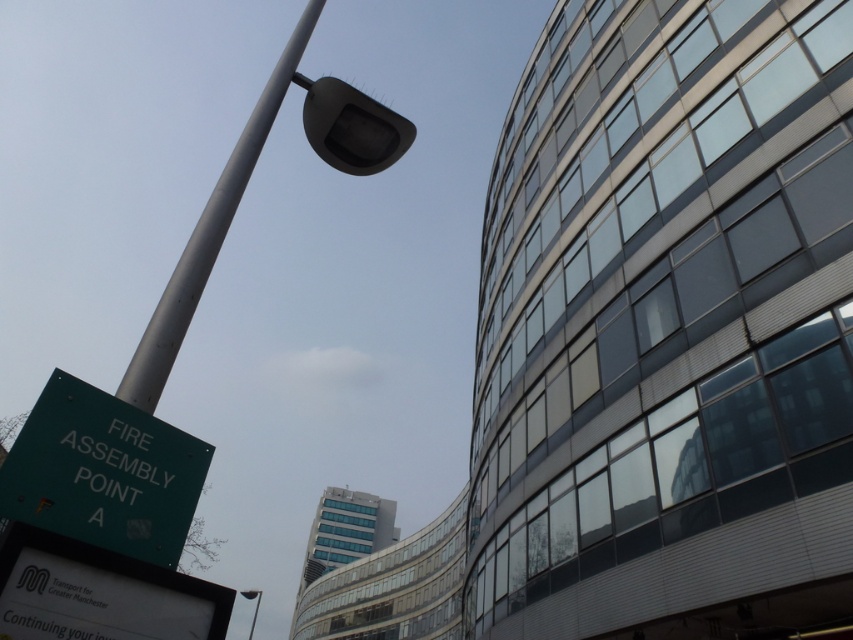
You are a pedestrian standing in front of the modern building. You see the green matte sign at lower left and the metallic gray street light at upper left. Which object is taller?

The metallic gray street light at upper left is taller than the green matte sign at lower left.

You are standing in the urban area shown in the image. You see the green matte sign at lower left and the metallic gray street light at upper left. Which object is closer to you from your current position?

The green matte sign at lower left is positioned over metallic gray street light at upper left, so the green matte sign at lower left is closer to you.

You are standing at the center of the image and want to locate the green matte sign at lower left. According to the coordinates, in which direction should you look to find it?

The green matte sign at lower left is located at coordinates point (x=103, y=472), so you should look to the lower left direction to find it.